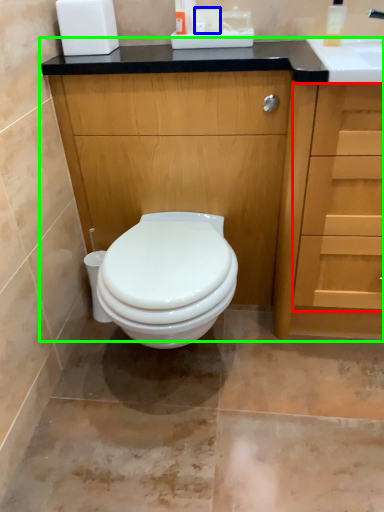
Question: Estimate the real-world distances between objects in this image. Which object is farther from drawer (highlighted by a red box), toilet paper (highlighted by a blue box) or bathroom cabinet (highlighted by a green box)?

Choices:
 (A) toilet paper
 (B) bathroom cabinet

Answer: (A)